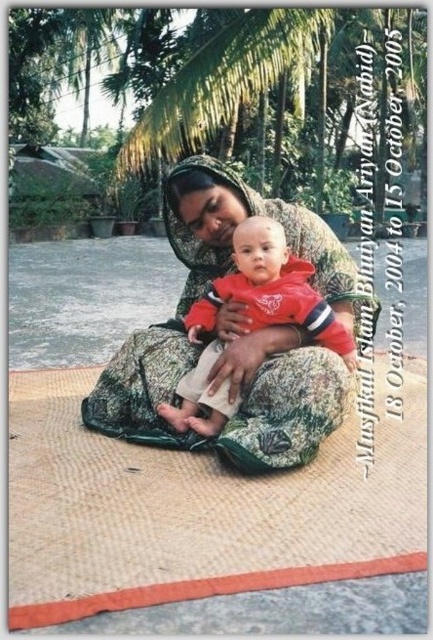
You are a photographer standing in front of the scene. You want to take a photo of the camouflage fabric at center and the red fleece jacket at center. Can you fit both objects in the frame if your camera has a maximum horizontal field of view of 3 inches?

The camouflage fabric at center and red fleece jacket at center are 3.16 inches apart from each other. Since the distance between them exceeds the camera s maximum horizontal field of view of 3 inches, you cannot fit both objects in the frame.

You are standing at the origin point in the scene. Which object is closest to you, the burlap mat at center or the palm trees in the background?

The burlap mat at center is closer to you because it is located at point (197, 508), which is closer to the origin than the palm trees in the background.

You are a photographer trying to capture the perfect shot of the baby in the image. You notice a point at coordinates (236,333). What is the color of the fabric at that point?

The point at coordinates (236,333) is on camouflage fabric at center, so the color would be a mix of green and brown patterns typical of camouflage.